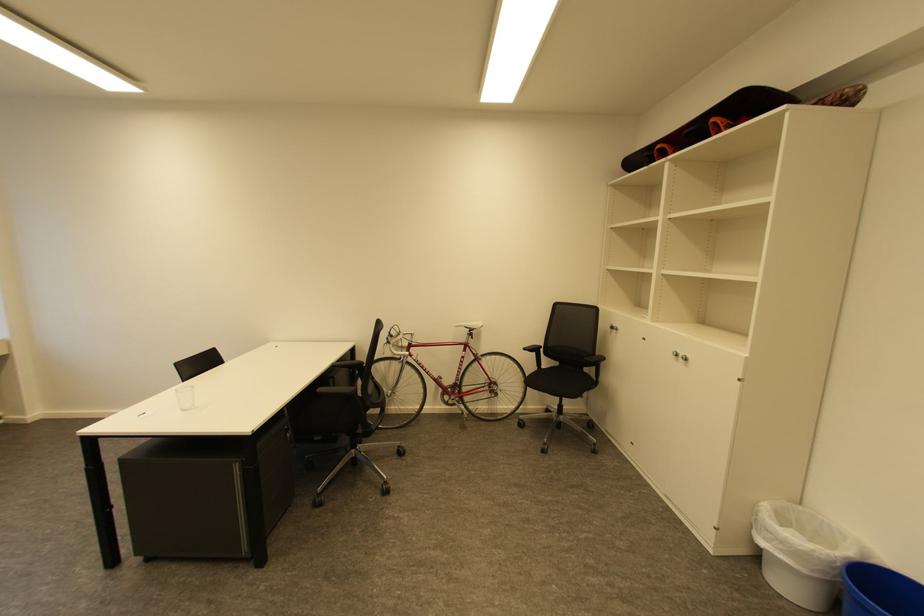
The location [711,123] corresponds to which object?

It refers to a black snowboard.